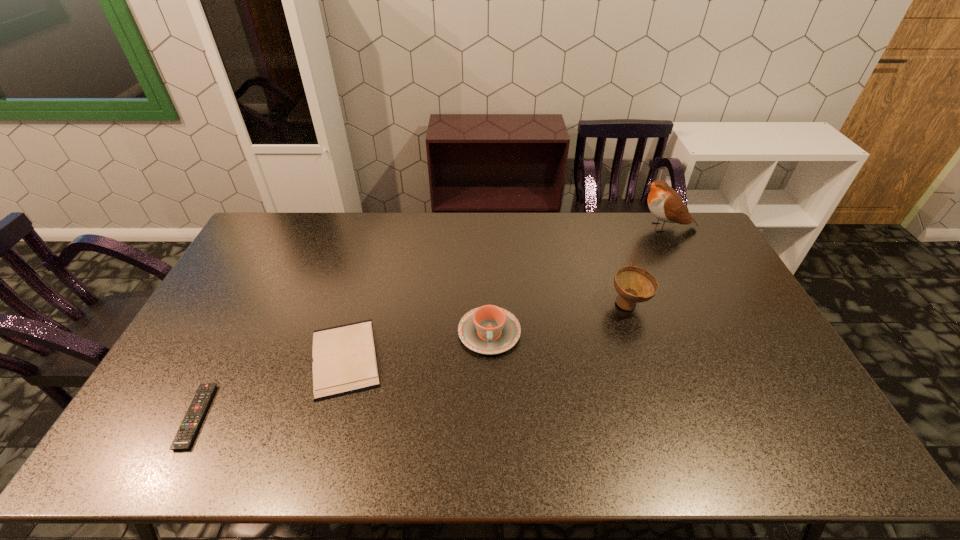
Identify the location of object that is at the right edge. The image size is (960, 540). (664, 202).

Where is `object at the near left corner`? The width and height of the screenshot is (960, 540). object at the near left corner is located at coordinates (185, 435).

Locate an element on the screen. The width and height of the screenshot is (960, 540). object present at the far right corner is located at coordinates (664, 202).

The width and height of the screenshot is (960, 540). I want to click on free region at the far edge of the desktop, so click(396, 224).

Identify the location of vacant space at the near edge of the desktop. (611, 443).

Image resolution: width=960 pixels, height=540 pixels. In order to click on vacant space at the left edge of the desktop in this screenshot , I will do `click(207, 373)`.

In the image, there is a desktop. Where is `vacant region at the far left corner`? This screenshot has width=960, height=540. vacant region at the far left corner is located at coordinates (293, 245).

The image size is (960, 540). Find the location of `free region at the near left corner`. free region at the near left corner is located at coordinates (176, 450).

The image size is (960, 540). What are the coordinates of `vacant region at the near right corner of the desktop` in the screenshot? It's located at (837, 454).

Identify the location of vacant point located between the rightmost object and the shortest object. The height and width of the screenshot is (540, 960). (431, 322).